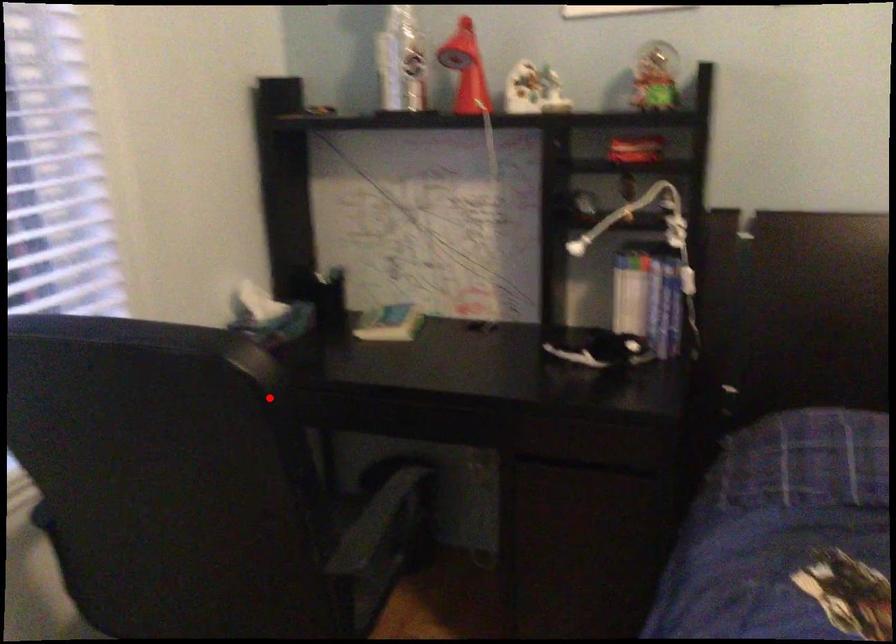
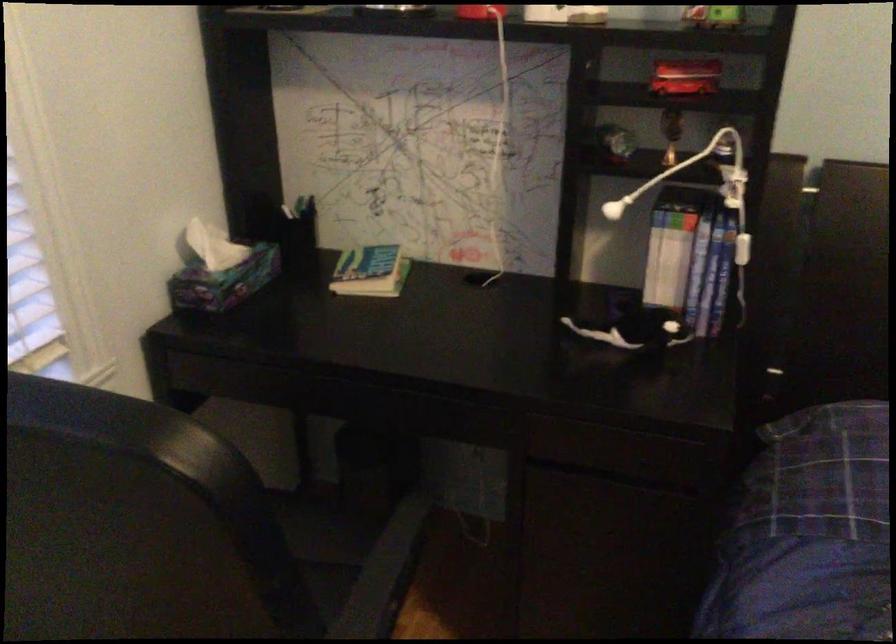
Where in the second image is the point corresponding to the highlighted location from the first image?

(234, 509)